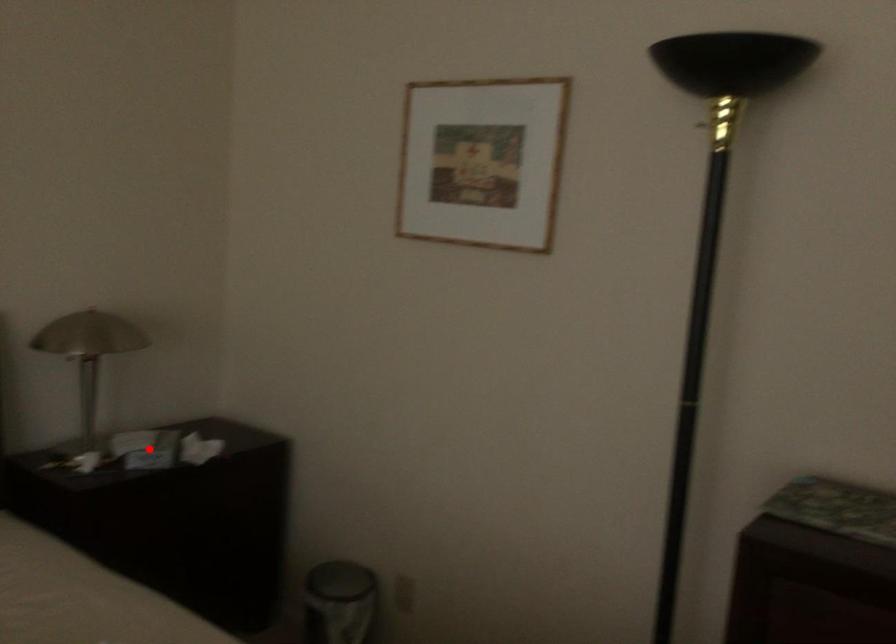
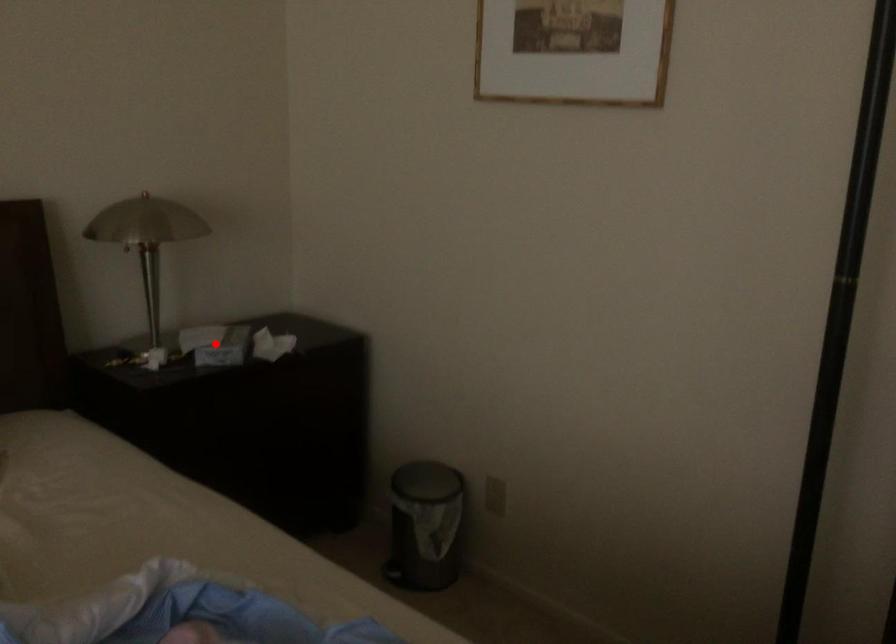
I am providing you with two images of the same scene from different viewpoints. A red point is marked on the first image and another point is marked on the second image. Does the point marked in image1 correspond to the same location as the one in image2?

Yes